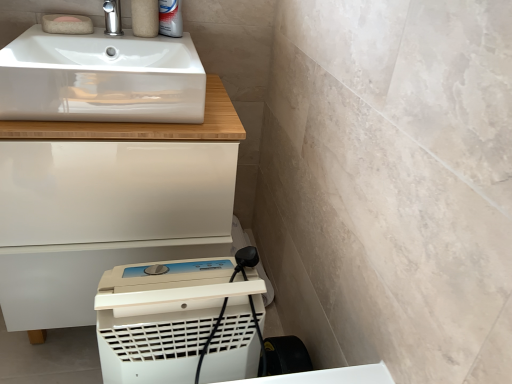
Question: Is polished chrome tap at upper left aimed at white glossy sink at upper left?

Choices:
 (A) no
 (B) yes

Answer: (B)

Question: Is polished chrome tap at upper left at the right side of white glossy sink at upper left?

Choices:
 (A) yes
 (B) no

Answer: (B)

Question: Considering the relative sizes of polished chrome tap at upper left and white glossy sink at upper left in the image provided, is polished chrome tap at upper left thinner than white glossy sink at upper left?

Choices:
 (A) no
 (B) yes

Answer: (B)

Question: Is polished chrome tap at upper left behind white glossy sink at upper left?

Choices:
 (A) yes
 (B) no

Answer: (A)

Question: Is polished chrome tap at upper left looking in the opposite direction of white glossy sink at upper left?

Choices:
 (A) yes
 (B) no

Answer: (A)

Question: From the image's perspective, is polished chrome tap at upper left positioned above or below matte beige soap at upper left, the 2th soap positioned from the front?

Choices:
 (A) above
 (B) below

Answer: (A)

Question: Relative to matte beige soap at upper left, the 2th soap positioned from the front, is polished chrome tap at upper left in front or behind?

Choices:
 (A) behind
 (B) front

Answer: (B)

Question: Does point (109, 1) appear closer or farther from the camera than point (61, 18)?

Choices:
 (A) farther
 (B) closer

Answer: (A)

Question: Considering the positions of polished chrome tap at upper left and matte beige soap at upper left, the 2th soap positioned from the front, in the image, is polished chrome tap at upper left wider or thinner than matte beige soap at upper left, the 2th soap positioned from the front,?

Choices:
 (A) thin
 (B) wide

Answer: (B)

Question: Is polished chrome tap at upper left bigger or smaller than pink felt soap at upper left, placed as the first soap when sorted from front to back?

Choices:
 (A) small
 (B) big

Answer: (B)

Question: Is point (106, 21) closer or farther from the camera than point (47, 18)?

Choices:
 (A) farther
 (B) closer

Answer: (A)

Question: Would you say polished chrome tap at upper left is inside or outside pink felt soap at upper left, placed as the first soap when sorted from front to back?

Choices:
 (A) inside
 (B) outside

Answer: (B)

Question: Considering their positions, is polished chrome tap at upper left located in front of or behind pink felt soap at upper left, placed as the first soap when sorted from front to back?

Choices:
 (A) front
 (B) behind

Answer: (A)

Question: Is point (134, 273) closer or farther from the camera than point (67, 16)?

Choices:
 (A) closer
 (B) farther

Answer: (A)

Question: Considering the positions of white plastic dehumidifier at lower center and matte beige soap at upper left, arranged as the 1th soap when viewed from the back, in the image, is white plastic dehumidifier at lower center wider or thinner than matte beige soap at upper left, arranged as the 1th soap when viewed from the back,?

Choices:
 (A) wide
 (B) thin

Answer: (A)